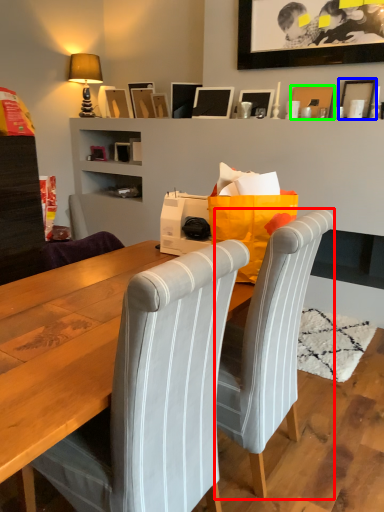
Question: Based on their relative distances, which object is farther from chair (highlighted by a red box)? Choose from picture frame (highlighted by a blue box) and picture frame (highlighted by a green box).

Choices:
 (A) picture frame
 (B) picture frame

Answer: (B)